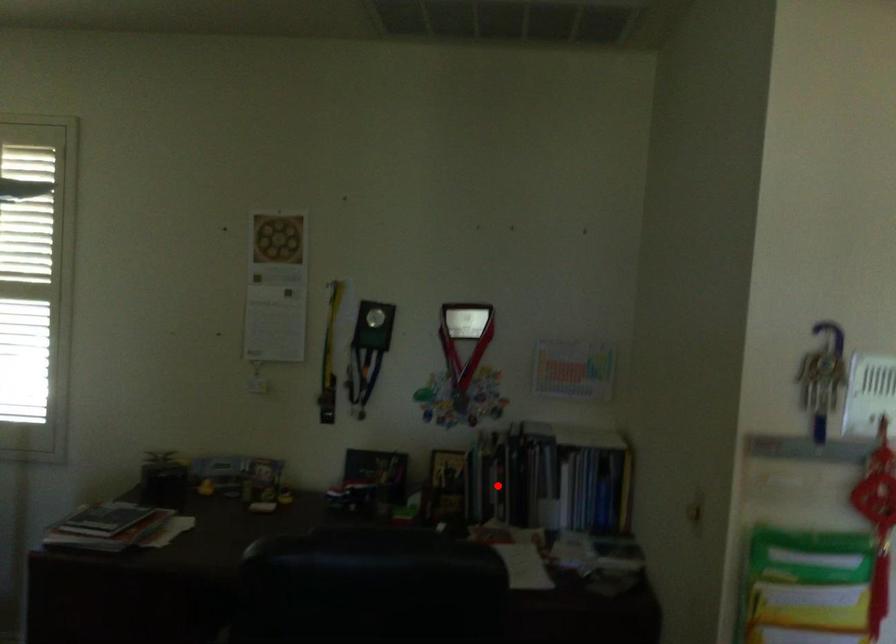
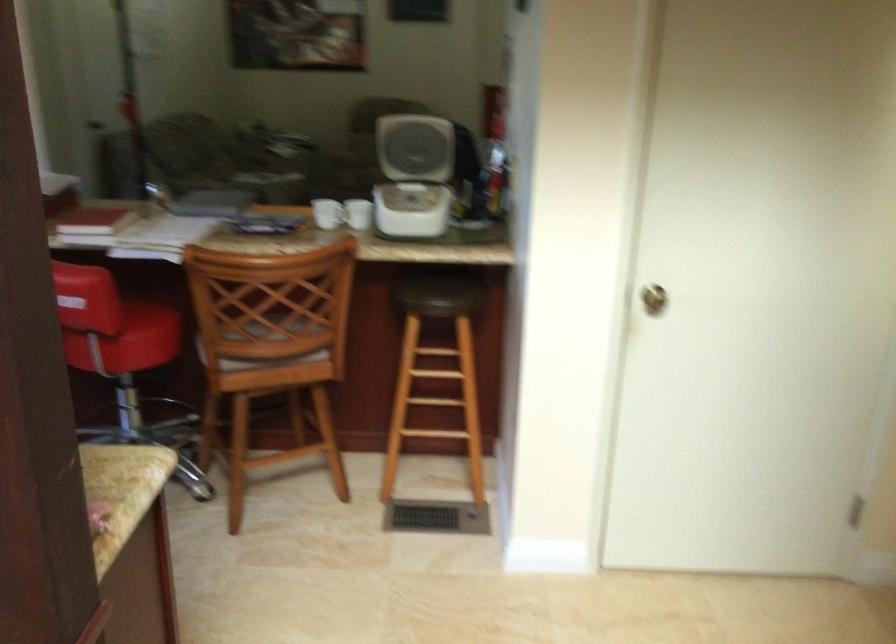
Question: I am providing you with two images of the same scene from different viewpoints. A red point is marked on the first image. At the location where the point appears in image 1, is it still visible in image 2?

Choices:
 (A) Yes
 (B) No

Answer: (B)